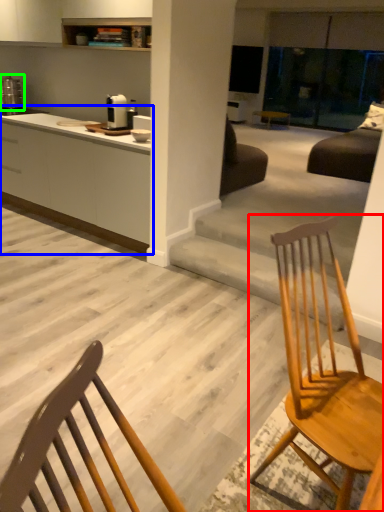
Question: Estimate the real-world distances between objects in this image. Which object is closer to chair (highlighted by a red box), cabinetry (highlighted by a blue box) or appliance (highlighted by a green box)?

Choices:
 (A) cabinetry
 (B) appliance

Answer: (A)